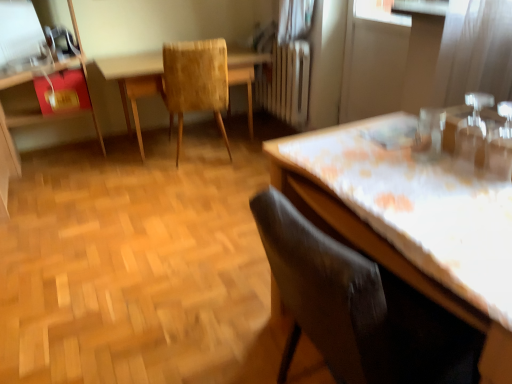
You are a GUI agent. You are given a task and a screenshot of the screen. Output one action in this format:
    pyautogui.click(x=<x>, y=<y>)
    Task: Click on the free space in front of matte red dresser at left
    
    Given the screenshot: What is the action you would take?
    pyautogui.click(x=62, y=235)